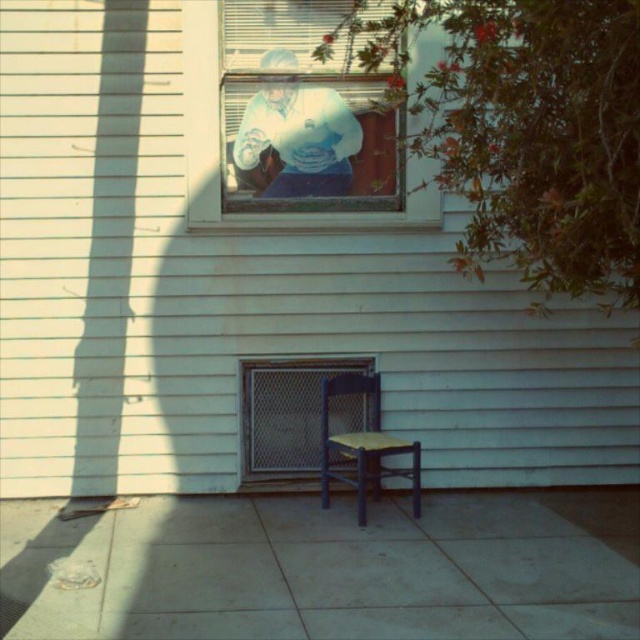
Based on the scene description, where is the clear glass window at upper center located relative to the white cotton shirt at upper center?

The clear glass window at upper center is located to the right of the white cotton shirt at upper center.

You are standing in front of the house and see the white cotton shirt at upper center and the metal mesh door at lower center. Which object is positioned higher in the image?

The white cotton shirt at upper center is positioned higher in the image than the metal mesh door at lower center because it is much taller as metal mesh door at lower center.

You are standing in front of the house and want to look through the clear glass window at upper center. Based on its position, where should you focus your gaze to see through it?

You should focus your gaze at point (218,150) to see through the clear glass window at upper center since that is its exact position.